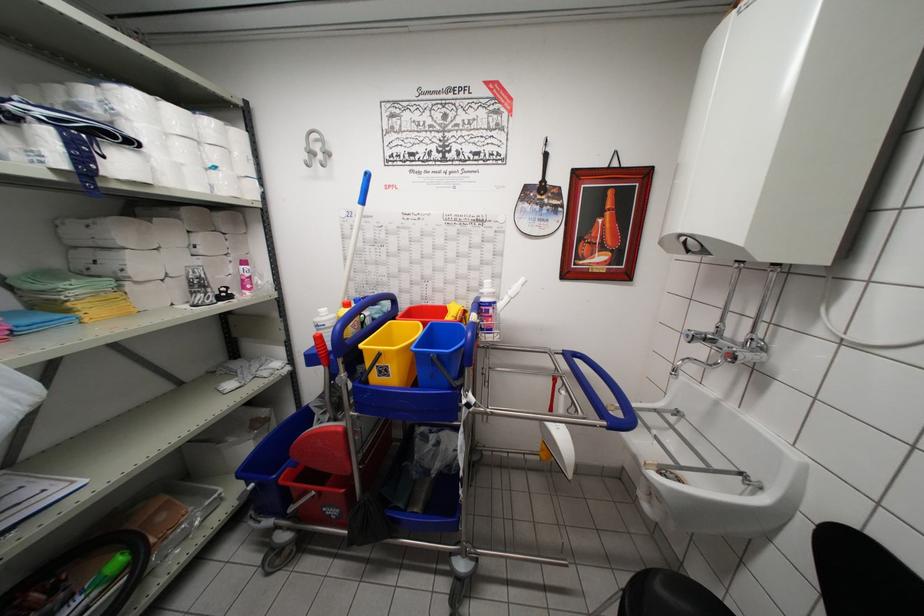
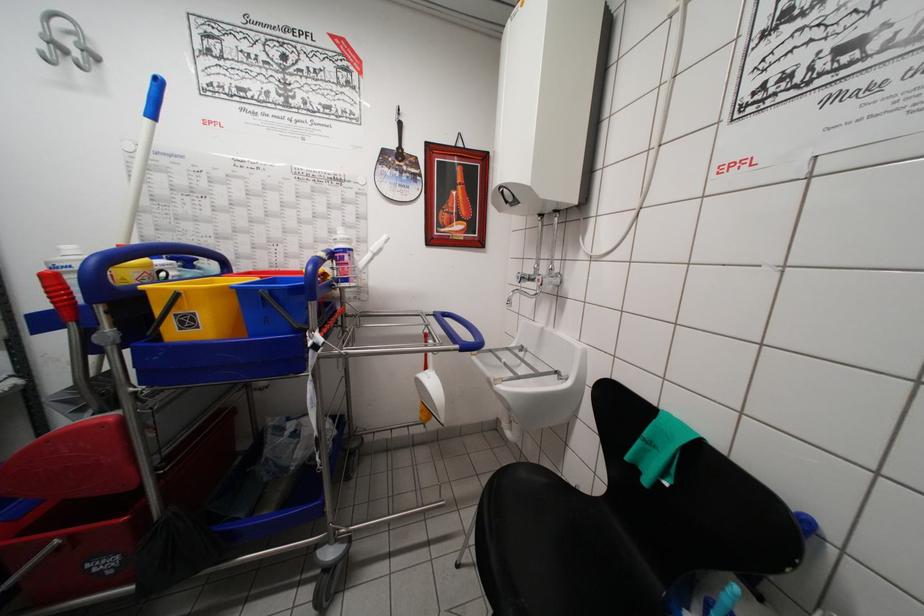
Question: The camera is either moving clockwise (left) or counter-clockwise (right) around the object. The first image is from the beginning of the video and the second image is from the end. Is the camera moving left or right when shooting the video?

Choices:
 (A) Left
 (B) Right

Answer: (A)